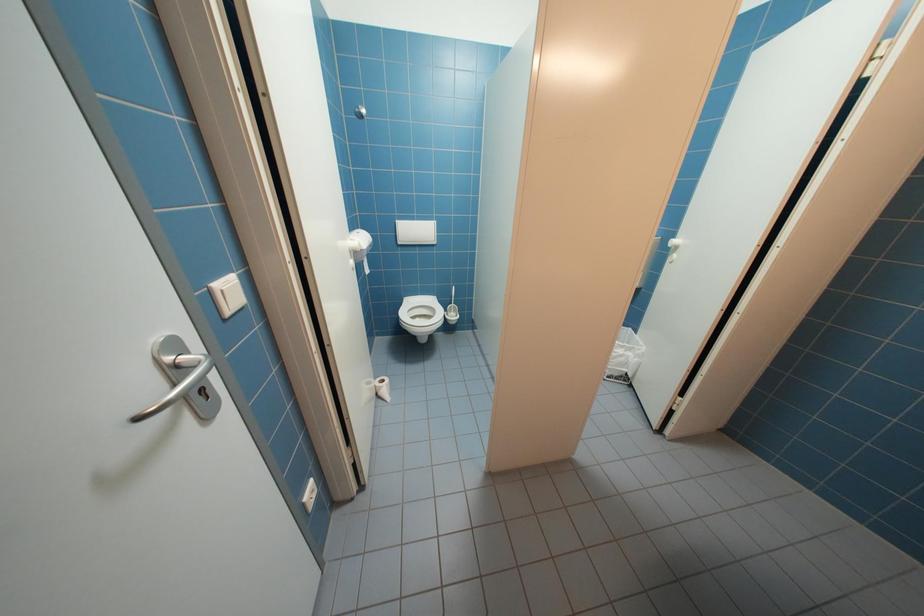
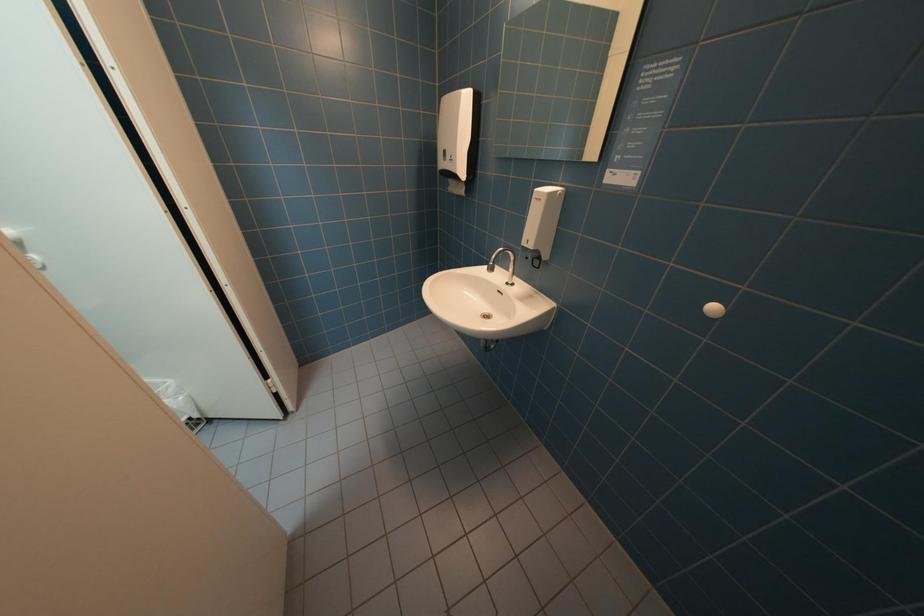
How did the camera likely rotate?

The rotation direction of the camera is right-down.